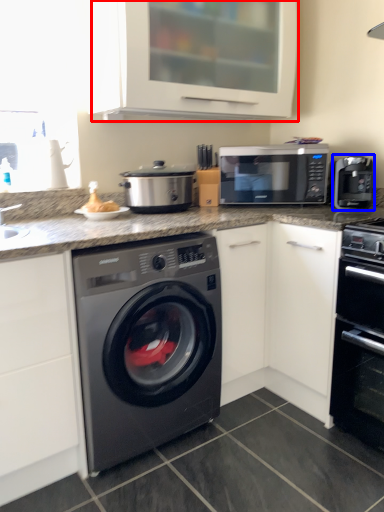
Question: Which of the following is the farthest to the observer, cabinetry (highlighted by a red box) or coffee machine (highlighted by a blue box)?

Choices:
 (A) cabinetry
 (B) coffee machine

Answer: (B)